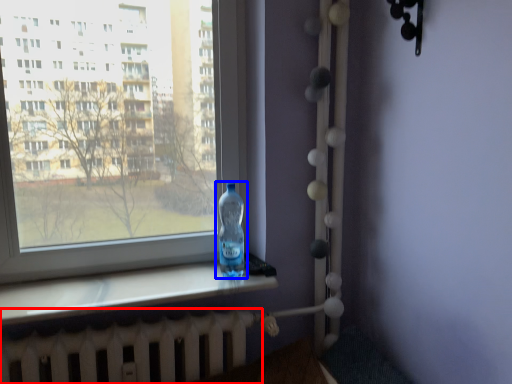
Question: Which point is further to the camera, radiator (highlighted by a red box) or bottle (highlighted by a blue box)?

Choices:
 (A) radiator
 (B) bottle

Answer: (B)